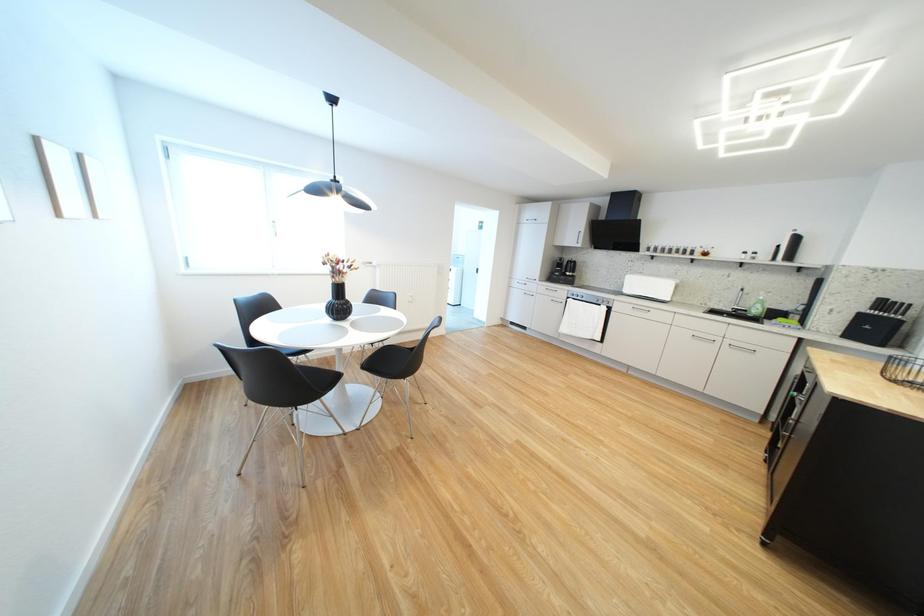
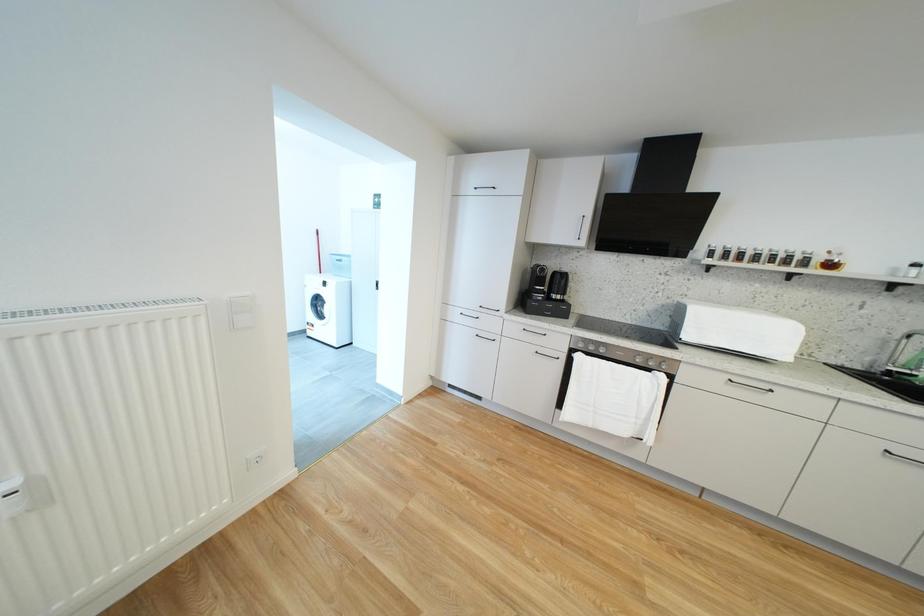
Question: In a continuous first-person perspective shot, in which direction is the camera moving?

Choices:
 (A) Left
 (B) Right
 (C) Forward
 (D) Backward

Answer: (C)